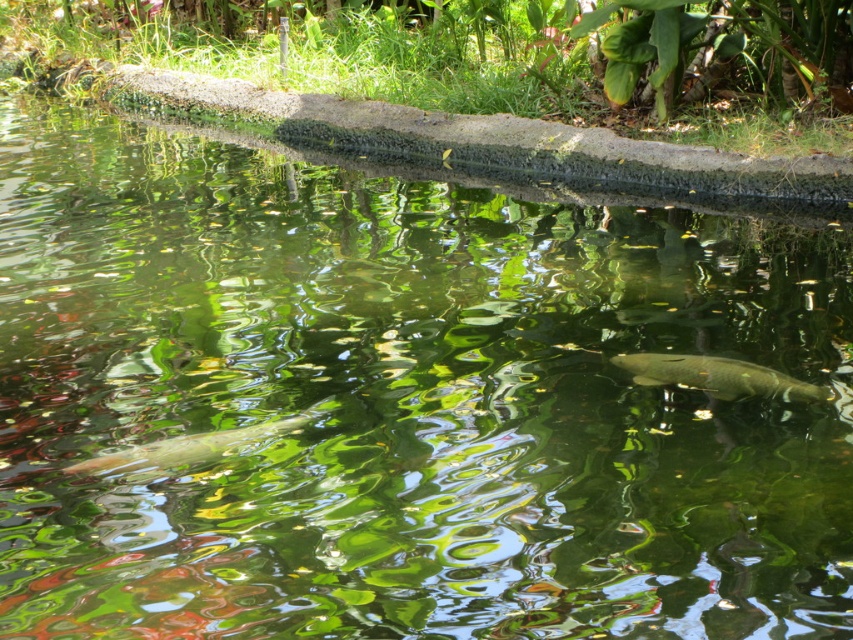
Question: Does green matte fish at center have a smaller size compared to shiny silver fish at lower left?

Choices:
 (A) yes
 (B) no

Answer: (B)

Question: Considering the relative positions of green matte fish at center and shiny silver fish at lower left in the image provided, where is green matte fish at center located with respect to shiny silver fish at lower left?

Choices:
 (A) left
 (B) right

Answer: (B)

Question: Is green matte fish at center positioned at the back of shiny silver fish at lower left?

Choices:
 (A) yes
 (B) no

Answer: (A)

Question: Which of the following is the farthest from the observer?

Choices:
 (A) shiny silver fish at lower left
 (B) green matte fish at center

Answer: (B)